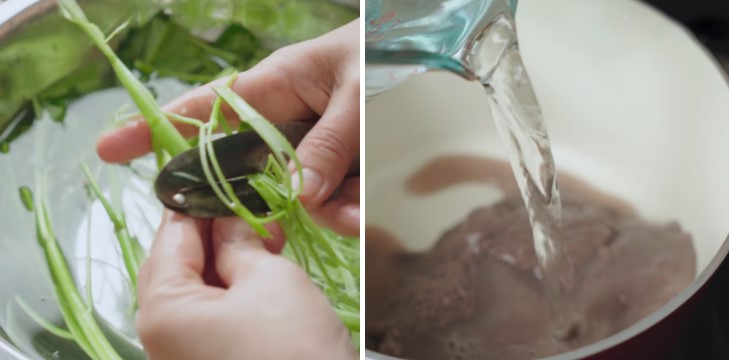
Identify the location of bowl. This screenshot has width=729, height=360. (647, 100).